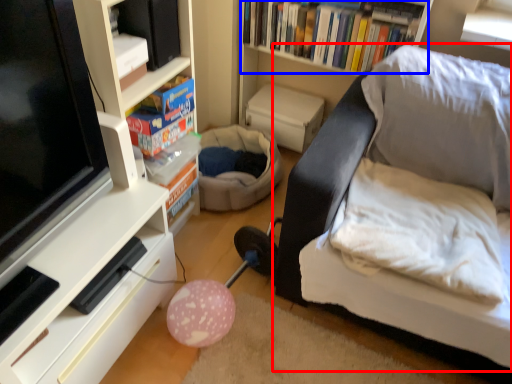
Question: Which object appears closest to the camera in this image, studio couch (highlighted by a red box) or book (highlighted by a blue box)?

Choices:
 (A) studio couch
 (B) book

Answer: (A)